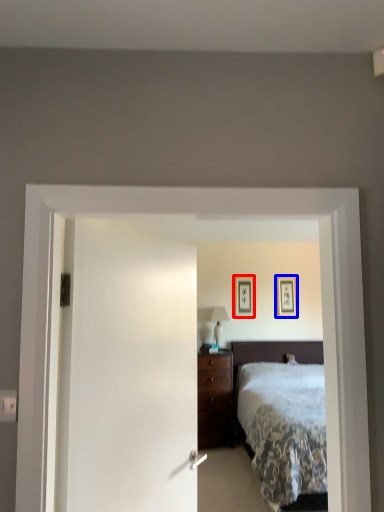
Question: Which point is closer to the camera, picture frame (highlighted by a red box) or picture frame (highlighted by a blue box)?

Choices:
 (A) picture frame
 (B) picture frame

Answer: (A)